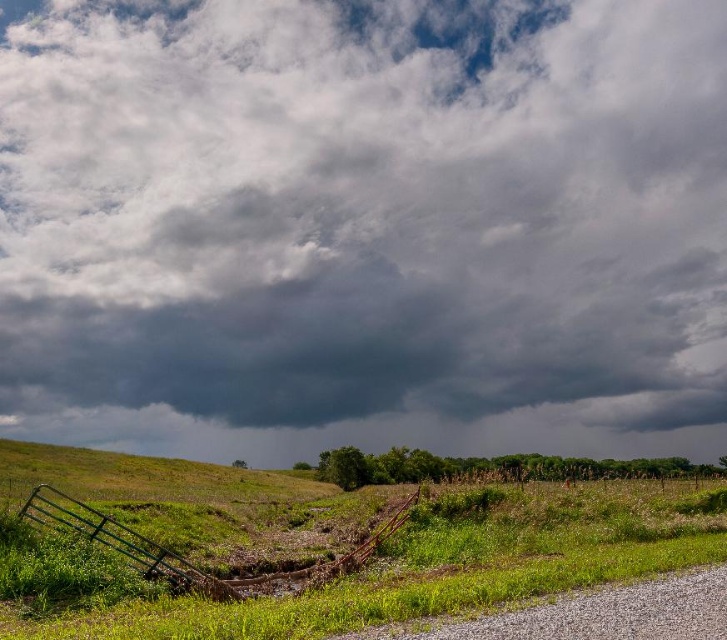
Question: Does dark gray cloud at upper center lie in front of green grassy field at lower left?

Choices:
 (A) yes
 (B) no

Answer: (B)

Question: Does dark gray cloud at upper center appear on the left side of green grassy field at lower left?

Choices:
 (A) yes
 (B) no

Answer: (B)

Question: Can you confirm if dark gray cloud at upper center is smaller than green grassy field at lower left?

Choices:
 (A) yes
 (B) no

Answer: (B)

Question: Which point appears farthest from the camera in this image?

Choices:
 (A) (240, 624)
 (B) (285, 328)

Answer: (B)

Question: Which of the following is the closest to the observer?

Choices:
 (A) dark gray cloud at upper center
 (B) green grassy field at lower left

Answer: (B)